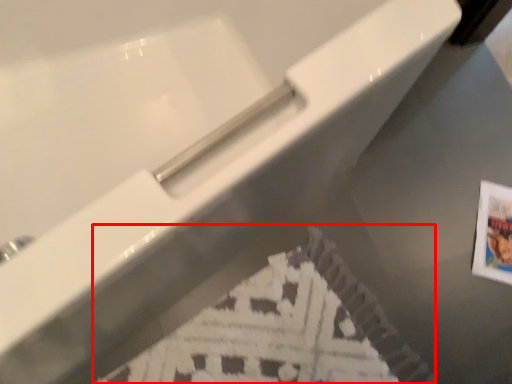
Question: From the image's perspective, what is the correct spatial positioning of flyer (annotated by the red box) in reference to postcard?

Choices:
 (A) below
 (B) above

Answer: (A)